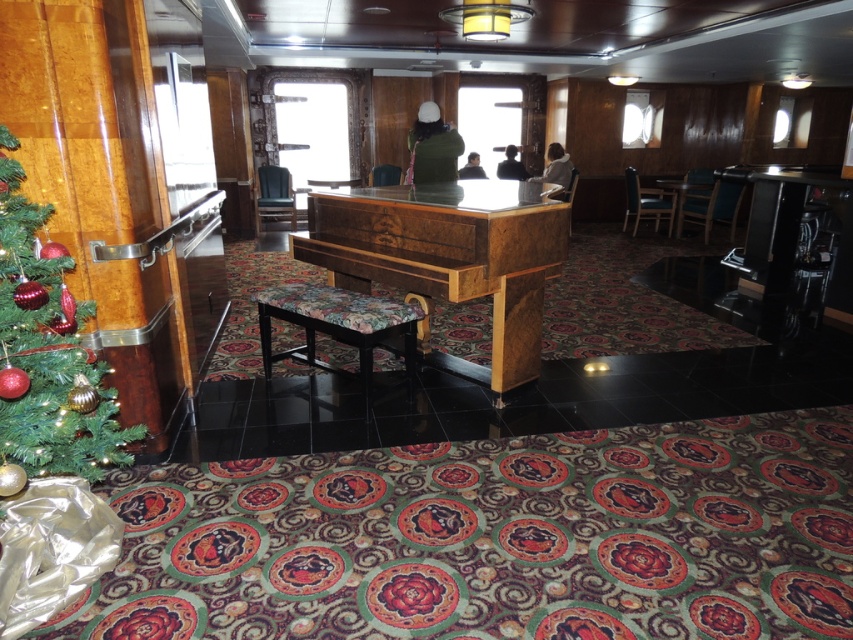
The width and height of the screenshot is (853, 640). What do you see at coordinates (450, 252) in the screenshot?
I see `wooden piano at center` at bounding box center [450, 252].

Does wooden piano at center have a larger size compared to green matte christmas tree at left?

Yes, wooden piano at center is bigger than green matte christmas tree at left.

The image size is (853, 640). I want to click on wooden piano at center, so click(450, 252).

Is wooden piano at center below wooden table at center?

Correct, wooden piano at center is located below wooden table at center.

Does wooden piano at center have a larger size compared to wooden table at center?

Indeed, wooden piano at center has a larger size compared to wooden table at center.

Describe the element at coordinates (450, 252) in the screenshot. Image resolution: width=853 pixels, height=640 pixels. I see `wooden piano at center` at that location.

Find the location of `wooden piano at center`. wooden piano at center is located at coordinates (450, 252).

Is wooden piano at center to the right of floral fabric stool at center from the viewer's perspective?

Yes, wooden piano at center is to the right of floral fabric stool at center.

Can you confirm if wooden piano at center is shorter than floral fabric stool at center?

No.

Where is `wooden piano at center`? Image resolution: width=853 pixels, height=640 pixels. wooden piano at center is located at coordinates (450, 252).